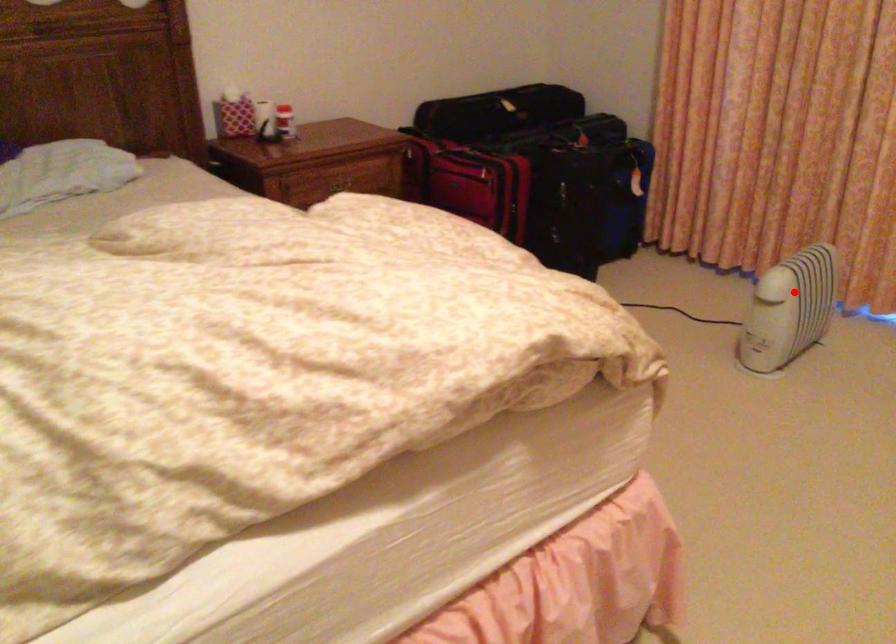
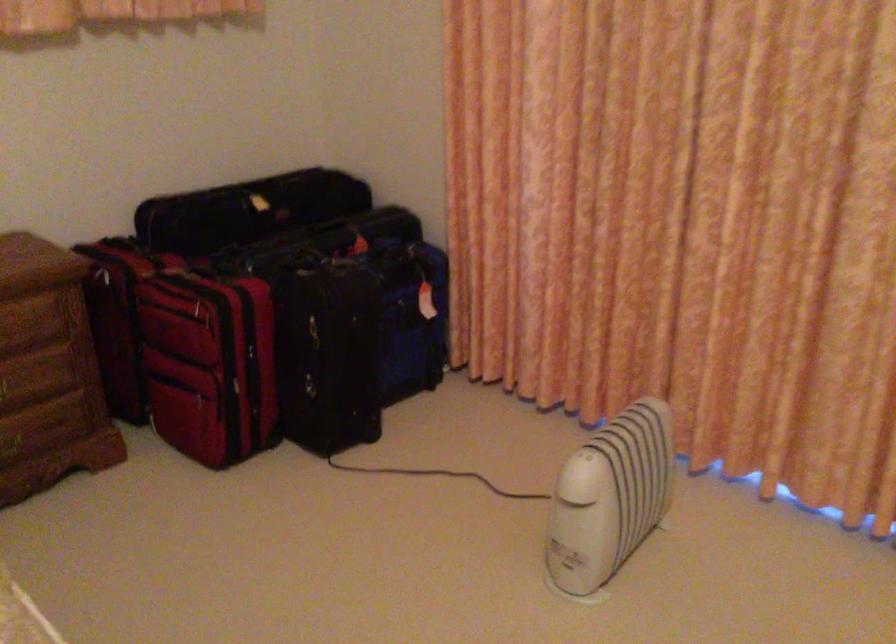
Question: I am providing you with two images of the same scene from different viewpoints. A red point is shown in image1. For the corresponding object point in image2, is it positioned nearer or farther from the camera?

Choices:
 (A) Nearer
 (B) Farther

Answer: (A)